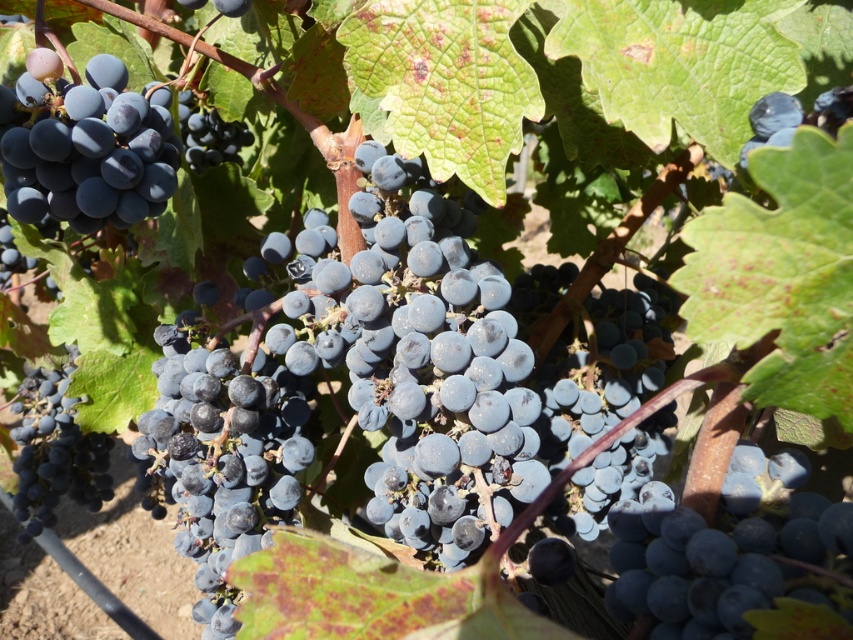
Question: Is shiny dark blue grapes at center below shiny dark blue grapes at upper left?

Choices:
 (A) no
 (B) yes

Answer: (B)

Question: Estimate the real-world distances between objects in this image. Which object is farther from the shiny dark blue grapes at center?

Choices:
 (A) shiny dark blue grape at upper left
 (B) shiny dark blue grape at lower left

Answer: (A)

Question: Which of the following is the farthest from the observer?

Choices:
 (A) shiny dark blue grape at lower left
 (B) shiny dark blue grapes at upper left
 (C) shiny dark blue grape at upper left

Answer: (C)

Question: Which of the following is the farthest from the observer?

Choices:
 (A) (7, 234)
 (B) (68, 196)

Answer: (A)

Question: Does shiny dark blue grapes at upper left have a lesser width compared to shiny dark blue grape at lower left?

Choices:
 (A) yes
 (B) no

Answer: (A)

Question: Is shiny dark blue grapes at upper left closer to the viewer compared to shiny dark blue grape at lower left?

Choices:
 (A) yes
 (B) no

Answer: (A)